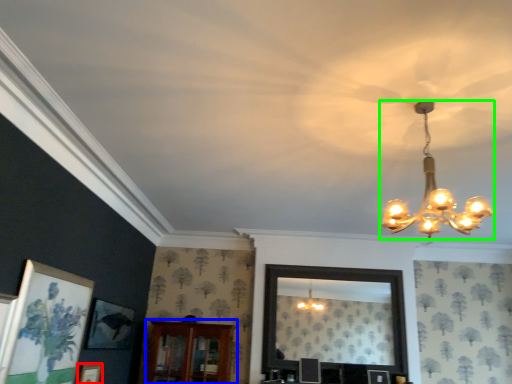
Question: Which is farther away from picture frame (highlighted by a red box)? furniture (highlighted by a blue box) or lamp (highlighted by a green box)?

Choices:
 (A) furniture
 (B) lamp

Answer: (B)